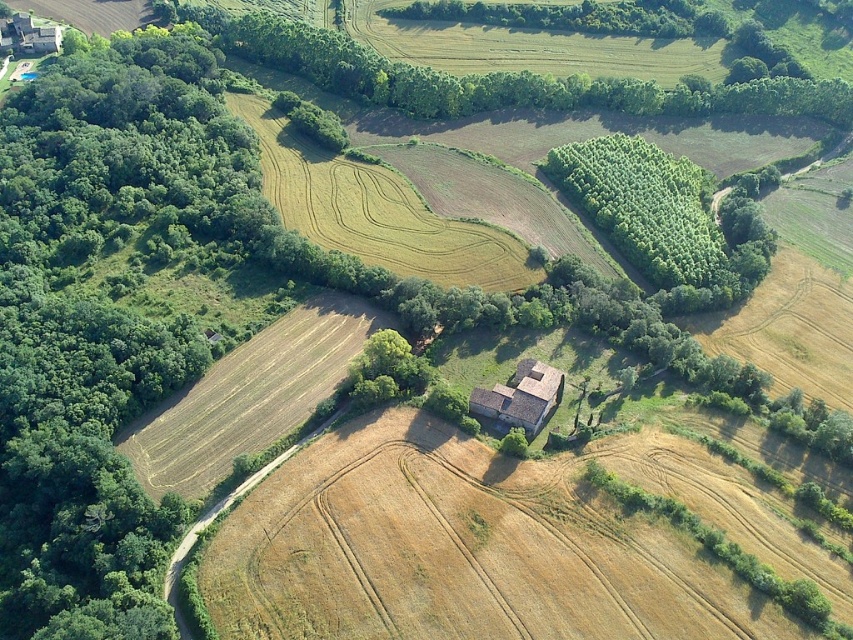
You are a surveyor planning to install two markers at the coordinates point (669, 264). The markers need to be spaced exactly 700 feet apart for accurate measurements. Based on the distance provided, will the markers be placed correctly?

The two markers at point (669, 264) are 682.59 feet apart, which is less than the required 700 feet. Therefore, the markers will not be placed correctly as they are too close together.